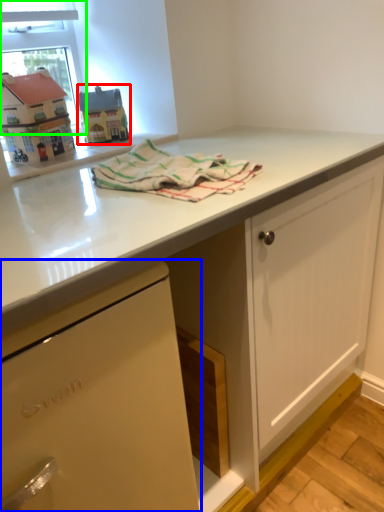
Question: Based on their relative distances, which object is farther from appliance (highlighted by a red box)? Choose from cabinetry (highlighted by a blue box) and window screen (highlighted by a green box).

Choices:
 (A) cabinetry
 (B) window screen

Answer: (A)